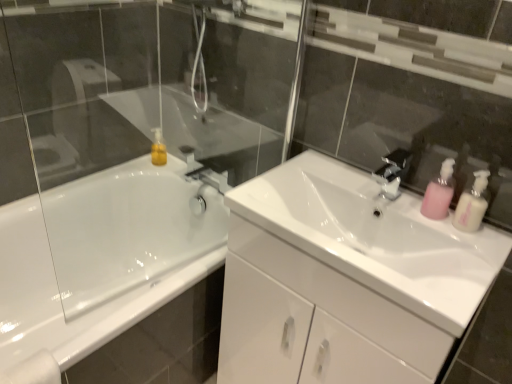
The image size is (512, 384). I want to click on blank area to the left of pink plastic soap dispenser at right, the second soap dispenser in the left-to-right sequence, so click(406, 210).